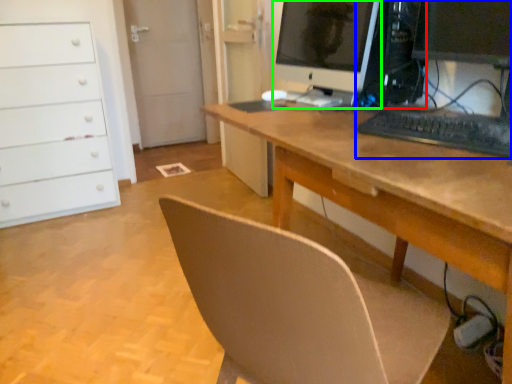
Question: Which object is positioned farthest from desktop computer (highlighted by a red box)? Select from computer (highlighted by a blue box) and computer monitor (highlighted by a green box).

Choices:
 (A) computer
 (B) computer monitor

Answer: (A)